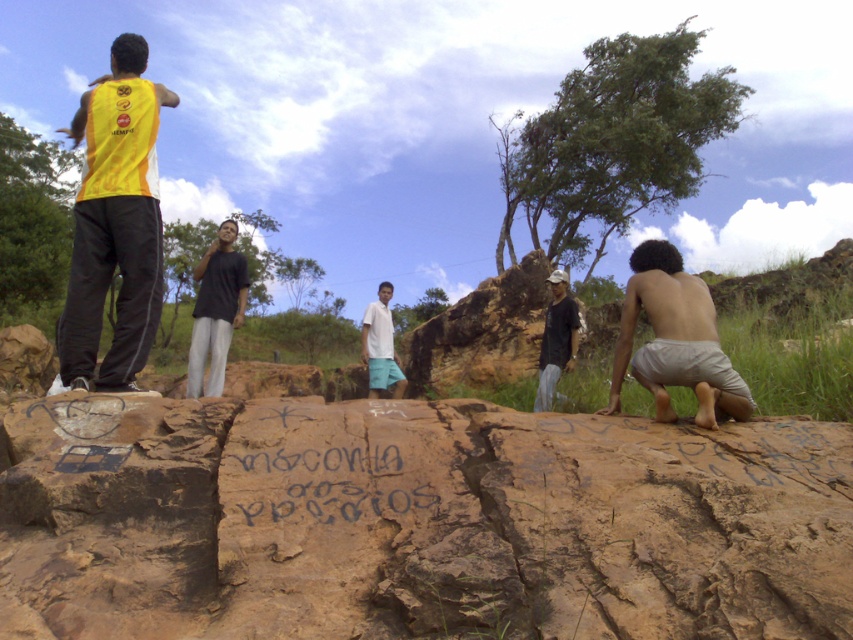
At what (x,y) coordinates should I click in order to perform the action: click on brown rough rock at center. Please return your answer as a coordinate pair (x, y). This screenshot has width=853, height=640. Looking at the image, I should click on (416, 522).

Does point (514, 480) come in front of point (372, 304)?

Yes, it is.

Is point (654, 554) behind point (376, 308)?

No.

Find the location of a particular element. brown rough rock at center is located at coordinates (416, 522).

This screenshot has width=853, height=640. What do you see at coordinates (416, 522) in the screenshot?
I see `brown rough rock at center` at bounding box center [416, 522].

Looking at this image, is brown rough rock at center smaller than dark gray fabric shirt at center?

Actually, brown rough rock at center might be larger than dark gray fabric shirt at center.

Which is behind, point (13, 499) or point (547, 378)?

Positioned behind is point (547, 378).

Find the location of a particular element. brown rough rock at center is located at coordinates (416, 522).

Is point (665, 404) positioned in front of point (397, 474)?

No, it is not.

From the picture: Is light beige shorts at lower right smaller than blue painted rock at center?

Actually, light beige shorts at lower right might be larger than blue painted rock at center.

Who is more forward, (619, 384) or (241, 468)?

Point (241, 468) is more forward.

Where is `light beige shorts at lower right`? light beige shorts at lower right is located at coordinates (675, 340).